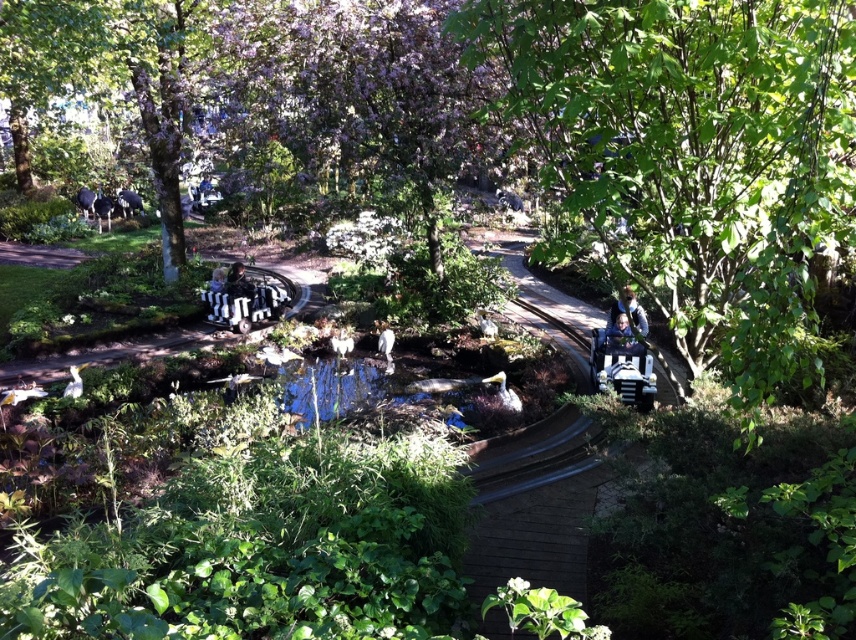
You are a photographer trying to capture both the blue denim jacket at upper right and the blue fabric jacket at center in a single shot. Based on their positions and sizes, which jacket should you focus on to ensure both are clearly visible in the frame?

The blue denim jacket at upper right might be wider than blue fabric jacket at center, so focusing on the blue denim jacket at upper right would help ensure both are visible as it occupies more space in the frame.

In the scene shown: You are a photographer trying to capture both the blue denim jacket at upper right and the smooth black car at center in a single frame. Based on their heights, which object will appear smaller in the photo?

The blue denim jacket at upper right will appear smaller in the photo because it is shorter than the smooth black car at center.